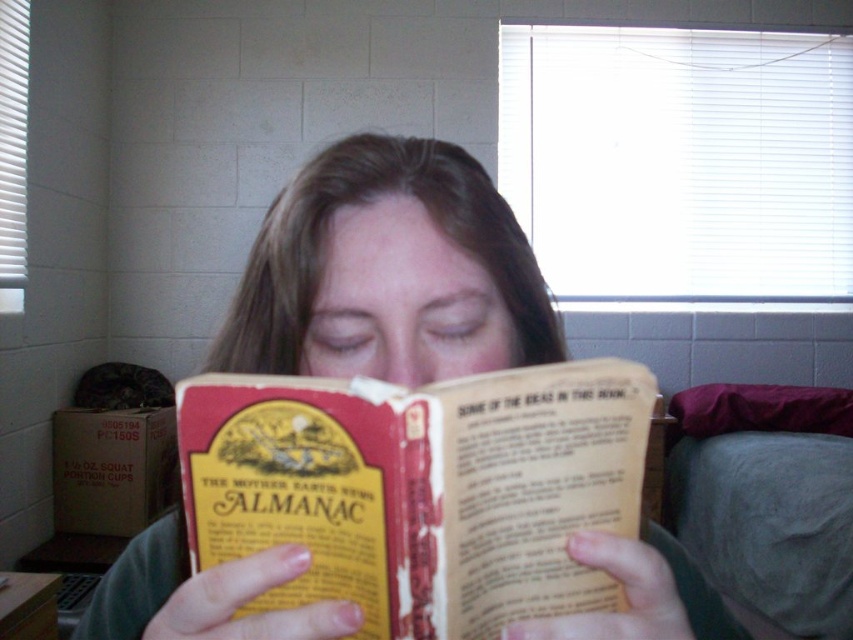
Question: Is yellow paper almanac at center wider than smooth brown hair at center?

Choices:
 (A) yes
 (B) no

Answer: (B)

Question: Which point appears farthest from the camera in this image?

Choices:
 (A) (300, 426)
 (B) (421, 268)

Answer: (B)

Question: Observing the image, what is the correct spatial positioning of yellow paper almanac at center in reference to smooth brown hair at center?

Choices:
 (A) above
 (B) below

Answer: (A)

Question: Considering the relative positions of yellow paper almanac at center and smooth brown hair at center in the image provided, where is yellow paper almanac at center located with respect to smooth brown hair at center?

Choices:
 (A) above
 (B) below

Answer: (A)

Question: Which object appears closest to the camera in this image?

Choices:
 (A) yellow paper almanac at center
 (B) smooth brown hair at center

Answer: (A)